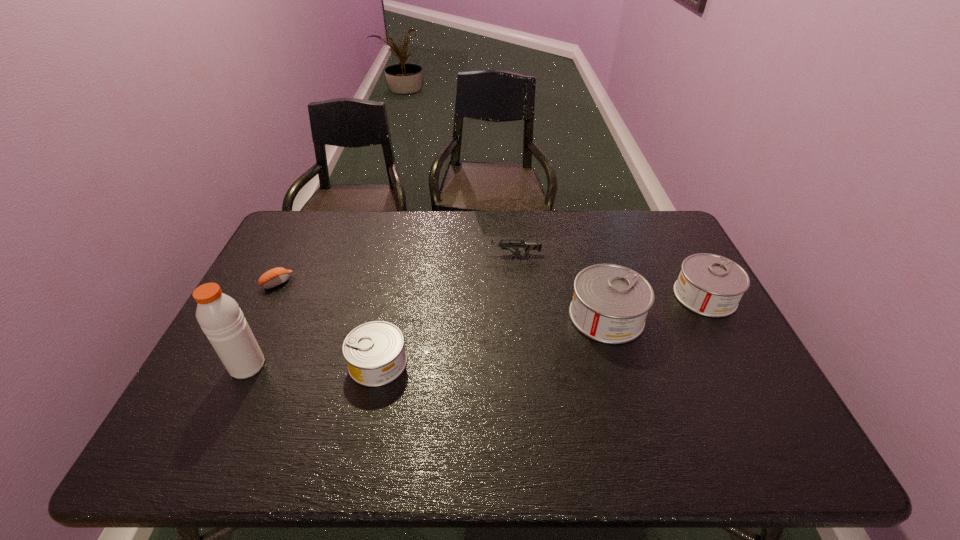
To make them evenly spaced by inserting another can among them, please locate a vacant spot for this new can. Please provide its 2D coordinates. Your answer should be formatted as a tuple, i.e. [(x, y)], where the tuple contains the x and y coordinates of a point satisfying the conditions above.

[(498, 338)]